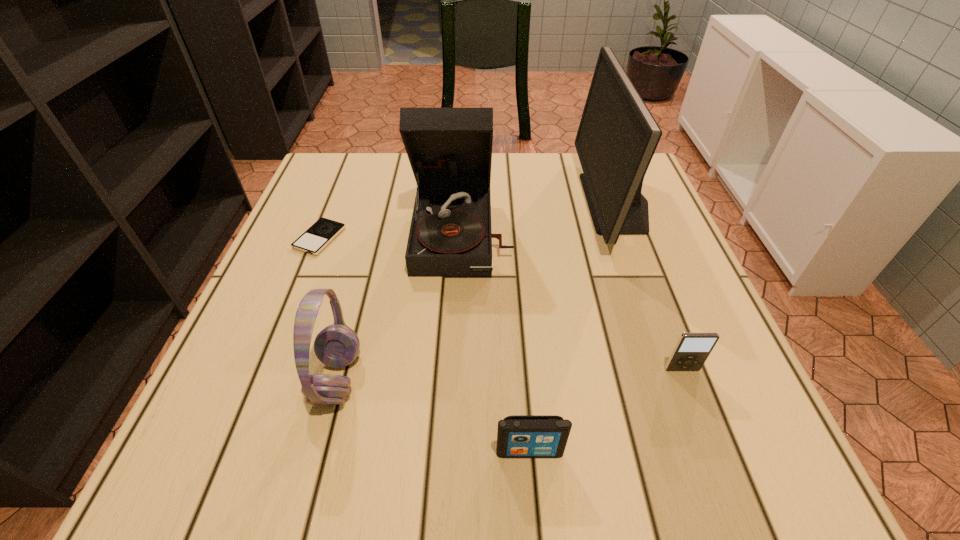
Where is `computer monitor`? computer monitor is located at coordinates (617, 137).

Locate an element on the screen. This screenshot has width=960, height=540. phonograph_record is located at coordinates (449, 149).

Where is `headset`? The image size is (960, 540). headset is located at coordinates (337, 345).

Identify the location of the third tallest object. (337, 345).

I want to click on the rightmost iPod, so click(692, 349).

I want to click on the nearest object, so click(x=518, y=436).

This screenshot has height=540, width=960. I want to click on the nearest iPod, so click(x=518, y=436).

In order to click on the farthest iPod in this screenshot , I will do `click(323, 231)`.

Identify the location of the shortest object. The image size is (960, 540). (323, 231).

The height and width of the screenshot is (540, 960). What are the coordinates of `vacant space located on the screen side of the computer monitor` in the screenshot? It's located at (459, 202).